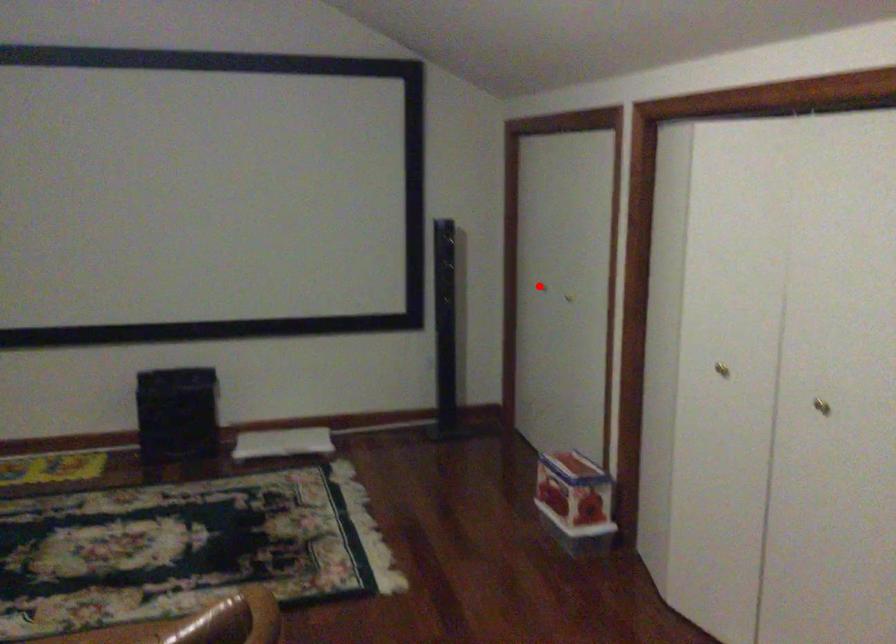
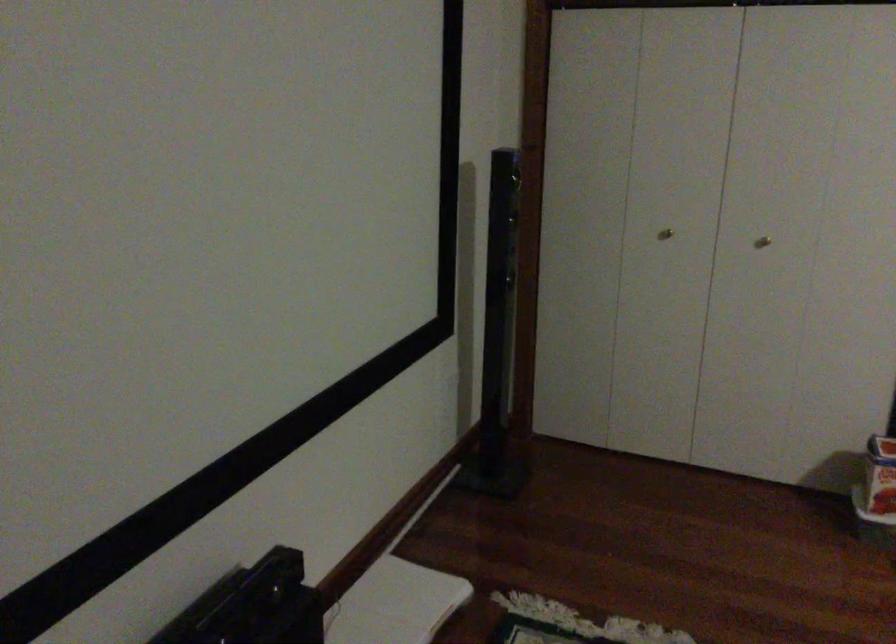
Question: I am providing you with two images of the same scene from different viewpoints. Given a red point in image1, look at the same physical point in image2. Is it:

Choices:
 (A) Closer to the viewpoint
 (B) Farther from the viewpoint

Answer: (A)